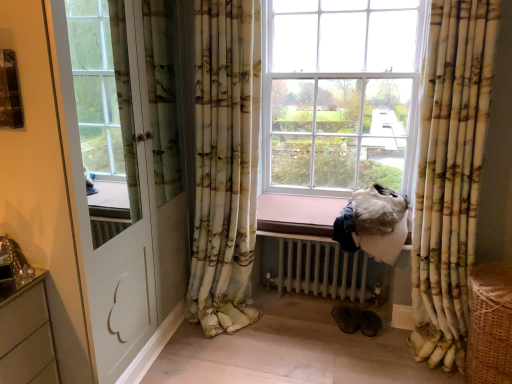
Where is `vacant area situated below white painted metal radiator at lower center (from a real-world perspective)`? This screenshot has width=512, height=384. vacant area situated below white painted metal radiator at lower center (from a real-world perspective) is located at coordinates 310,306.